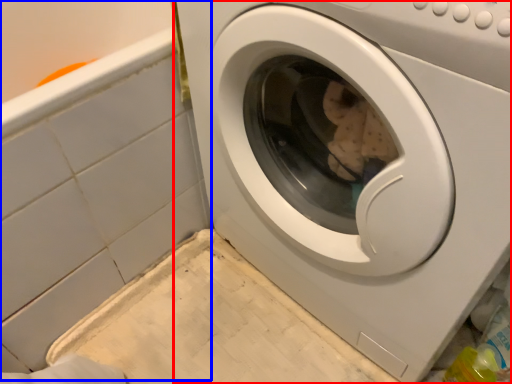
Question: Which object is further to the camera taking this photo, washing machine (highlighted by a red box) or bath (highlighted by a blue box)?

Choices:
 (A) washing machine
 (B) bath

Answer: (B)